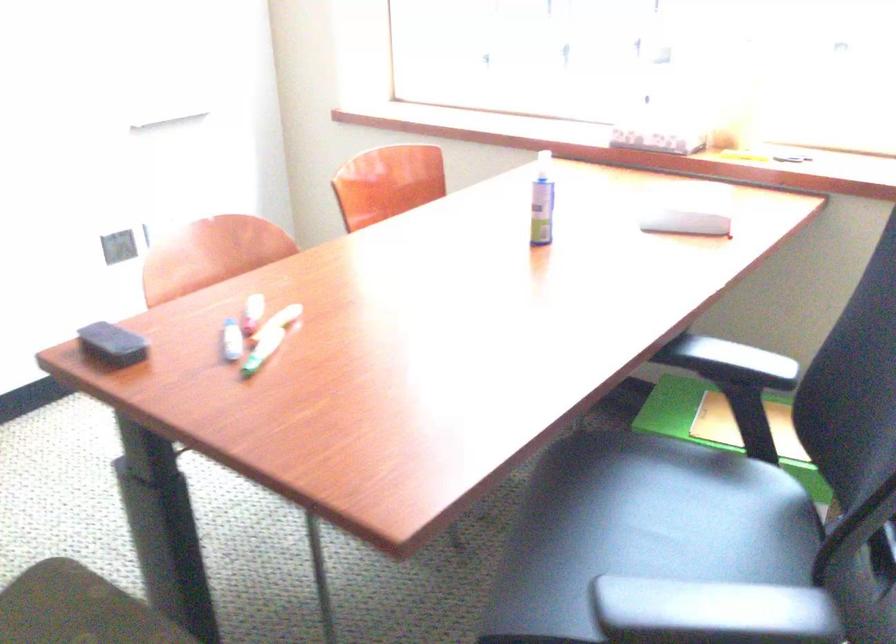
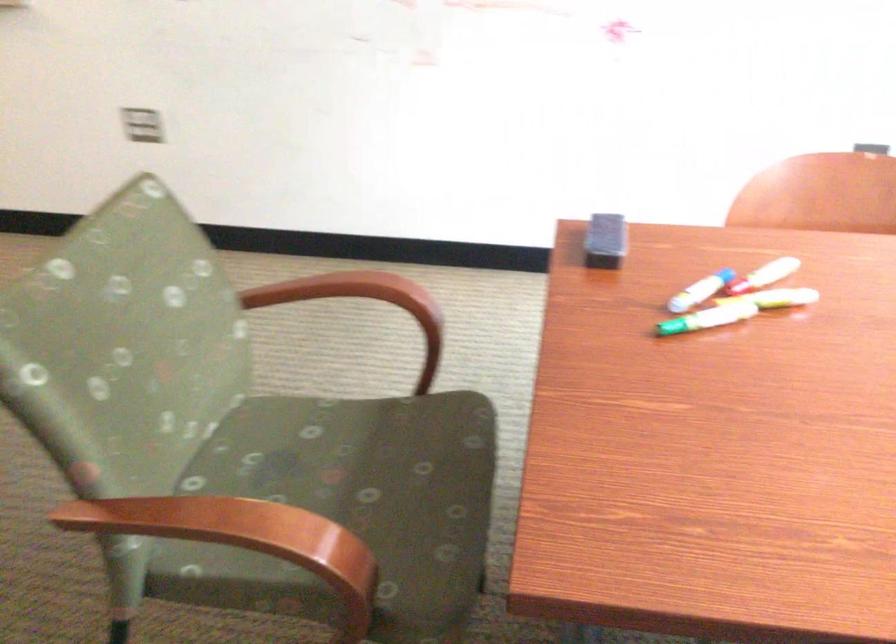
Locate, in the second image, the point that corresponds to pixel 255 361 in the first image.

(675, 327)